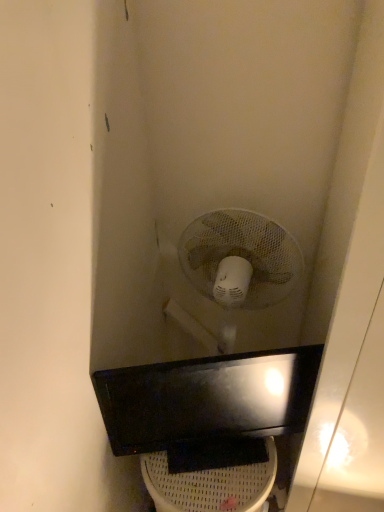
Question: Considering the positions of point (299, 359) and point (218, 478), is point (299, 359) closer or farther from the camera than point (218, 478)?

Choices:
 (A) farther
 (B) closer

Answer: (B)

Question: Considering their positions, is black glossy sink at center located in front of or behind white plastic toilet bowl at lower center?

Choices:
 (A) behind
 (B) front

Answer: (B)

Question: Based on their sizes in the image, would you say black glossy sink at center is bigger or smaller than white plastic toilet bowl at lower center?

Choices:
 (A) big
 (B) small

Answer: (B)

Question: From the image's perspective, is white plastic toilet bowl at lower center located above or below black glossy sink at center?

Choices:
 (A) below
 (B) above

Answer: (A)

Question: In terms of width, does white plastic toilet bowl at lower center look wider or thinner when compared to black glossy sink at center?

Choices:
 (A) wide
 (B) thin

Answer: (A)

Question: Which is correct: white plastic toilet bowl at lower center is inside black glossy sink at center, or outside of it?

Choices:
 (A) outside
 (B) inside

Answer: (A)

Question: Does point (192, 504) appear closer or farther from the camera than point (259, 356)?

Choices:
 (A) closer
 (B) farther

Answer: (B)